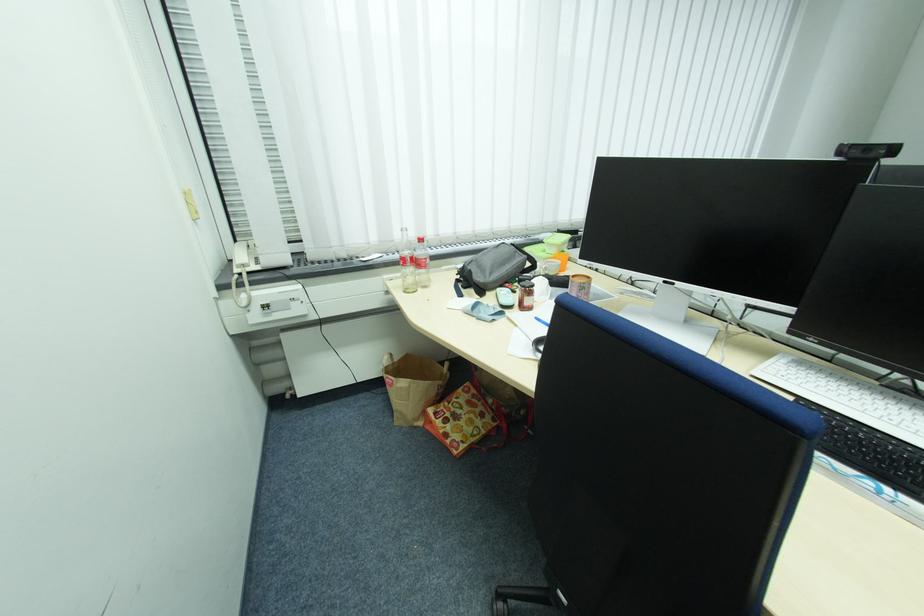
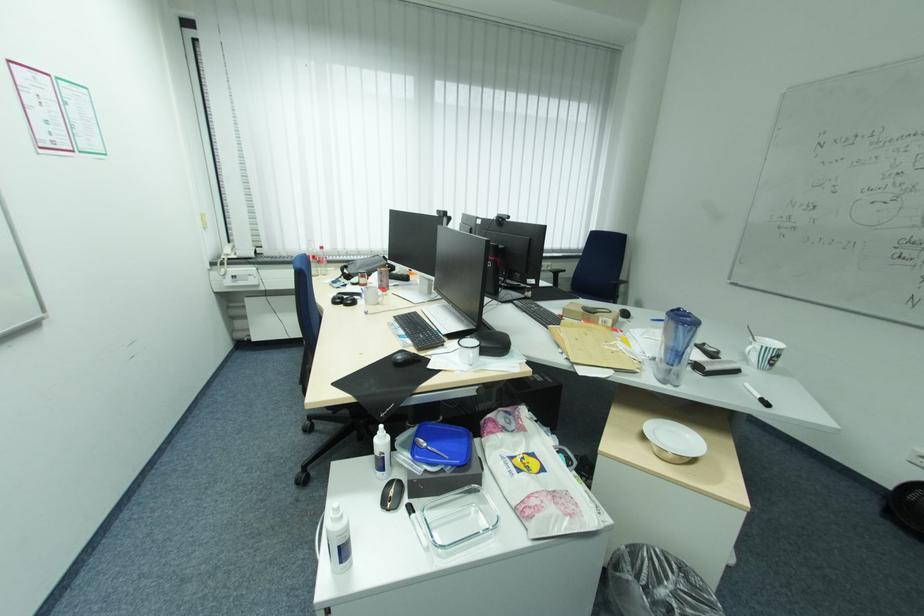
In the second image, find the point that corresponds to (x=250, y=265) in the first image.

(234, 254)